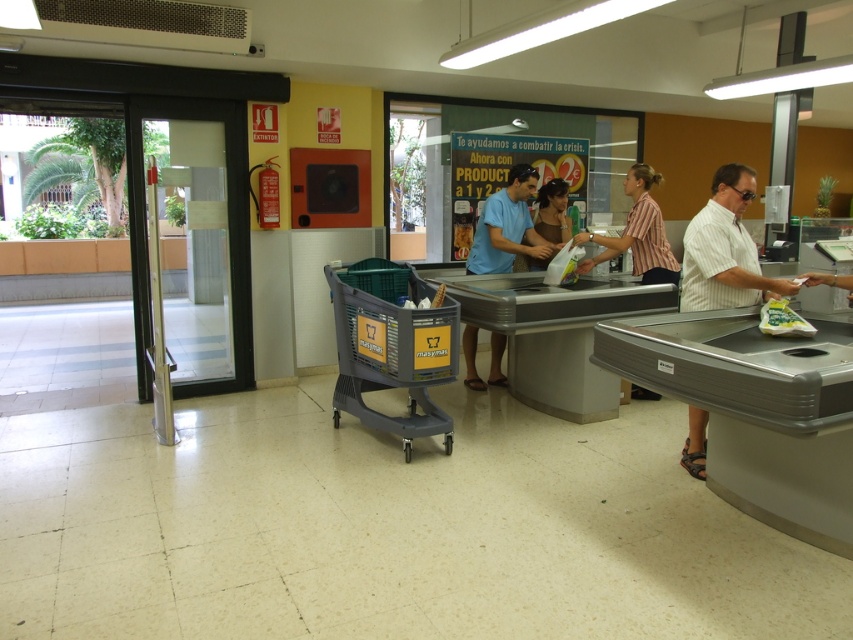
You are a customer in the supermarket checkout area. You notice two shirts displayed on mannequins near the counters. The white striped shirt at right and the striped cotton shirt at center. Which shirt is narrower?

The white striped shirt at right is narrower than the striped cotton shirt at center.

You are a customer trying to reach the cashier at the checkout counter. You see the gray plastic shopping cart at center and the white striped shirt at right. Which object is closer to you?

The gray plastic shopping cart at center is closer to you because the white striped shirt at right is behind it.

You are a customer standing at the checkout area. You see a gray plastic shopping cart at center and a white striped shirt at right. Which object takes up more space in the scene?

The gray plastic shopping cart at center is bigger than the white striped shirt at right, so it takes up more space in the scene.